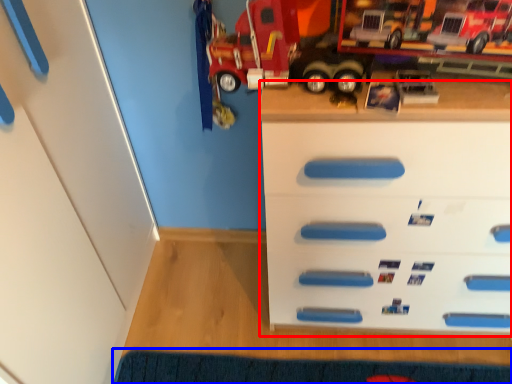
Question: Which of the following is the closest to the observer, chest of drawers (highlighted by a red box) or doormat (highlighted by a blue box)?

Choices:
 (A) chest of drawers
 (B) doormat

Answer: (A)